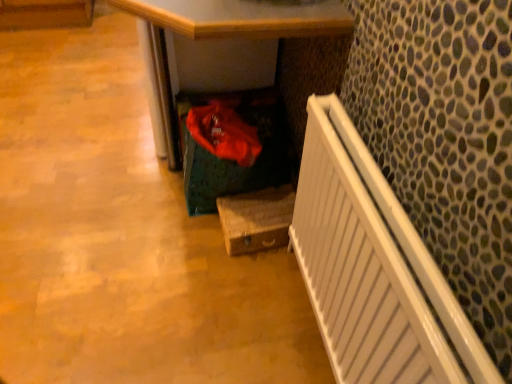
Locate an element on the screen. The height and width of the screenshot is (384, 512). free space to the left of wooden box at lower center is located at coordinates (185, 235).